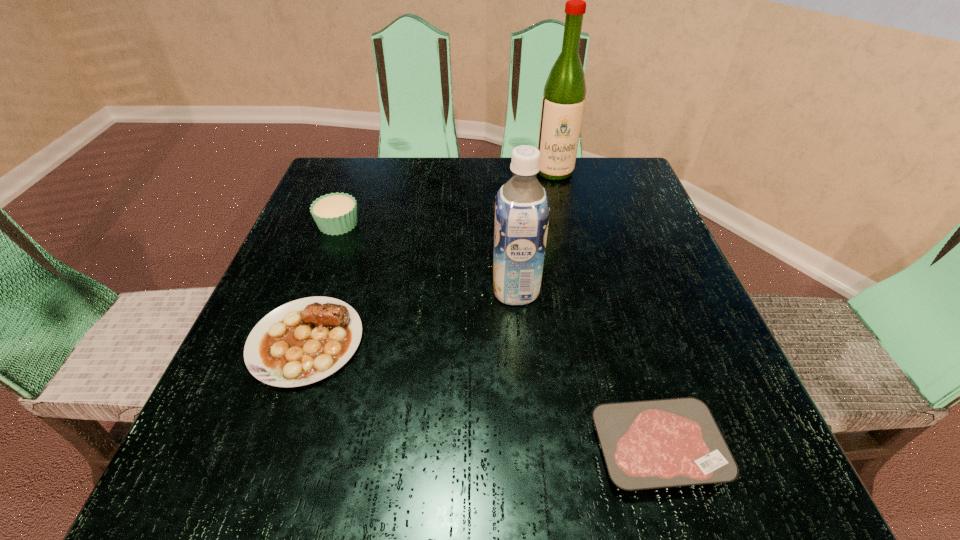
Locate an element on the screen. cupcake that is at the left edge is located at coordinates (336, 213).

Where is `steak at the left edge`? The height and width of the screenshot is (540, 960). steak at the left edge is located at coordinates (304, 341).

The width and height of the screenshot is (960, 540). I want to click on liquor that is positioned at the right edge, so click(563, 101).

Where is `steak located in the right edge section of the desktop`? steak located in the right edge section of the desktop is located at coordinates (649, 444).

Locate an element on the screen. The width and height of the screenshot is (960, 540). object that is at the far left corner is located at coordinates (336, 213).

This screenshot has width=960, height=540. In order to click on object at the far right corner in this screenshot , I will do `click(563, 101)`.

The width and height of the screenshot is (960, 540). I want to click on object located in the near right corner section of the desktop, so click(649, 444).

Where is `vacant region at the far edge of the desktop`? vacant region at the far edge of the desktop is located at coordinates (436, 170).

In the image, there is a desktop. In order to click on free space at the near edge in this screenshot , I will do pos(516,470).

Where is `free location at the left edge`? free location at the left edge is located at coordinates (322, 242).